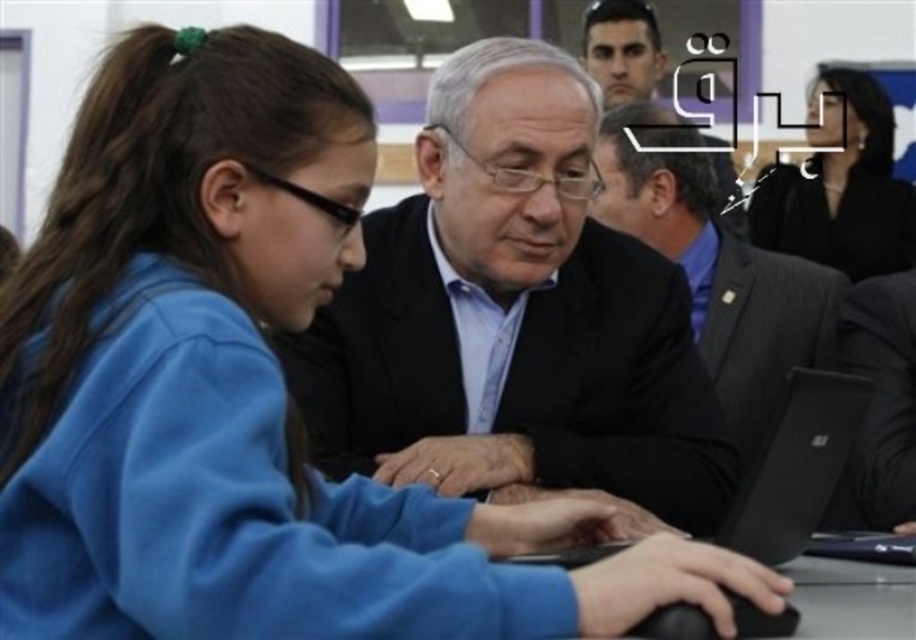
You are a photographer standing in the scene and want to capture a photo where both the black glossy hair at upper right and the dark suit at center are clearly visible. Based on their heights, which object should you focus on first to ensure proper framing?

The black glossy hair at upper right is much taller than the dark suit at center, so you should focus on the black glossy hair at upper right first to ensure proper framing.

You are standing in the room and want to reach both the point at coordinates (398, 259) and the point at coordinates (679, 198). Which point should you go to first if you want to reach the one closer to you first?

You should go to point (398, 259) first because it is closer to you than point (679, 198).

You are an event planner arranging seating for a formal event. You have two suits at center in the image, a matte black suit at center and a dark gray suit at center. Which suit should you place closer to the front of the stage to ensure visibility for both suits?

The matte black suit at center is shorter than the dark gray suit at center, so placing the shorter matte black suit at center closer to the front of the stage would ensure both suits are visible to the audience.